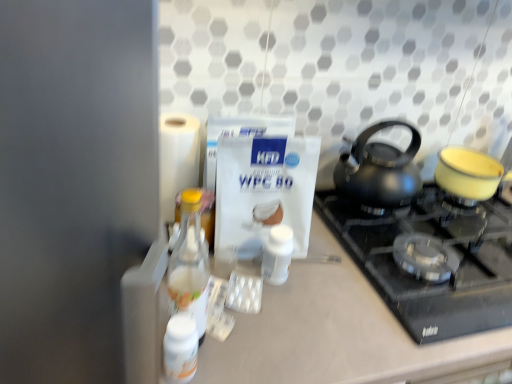
The image size is (512, 384). Identify the location of vacant space to the right of clear glass bottle at left, marked as the 2th bottle in a left-to-right arrangement. (268, 336).